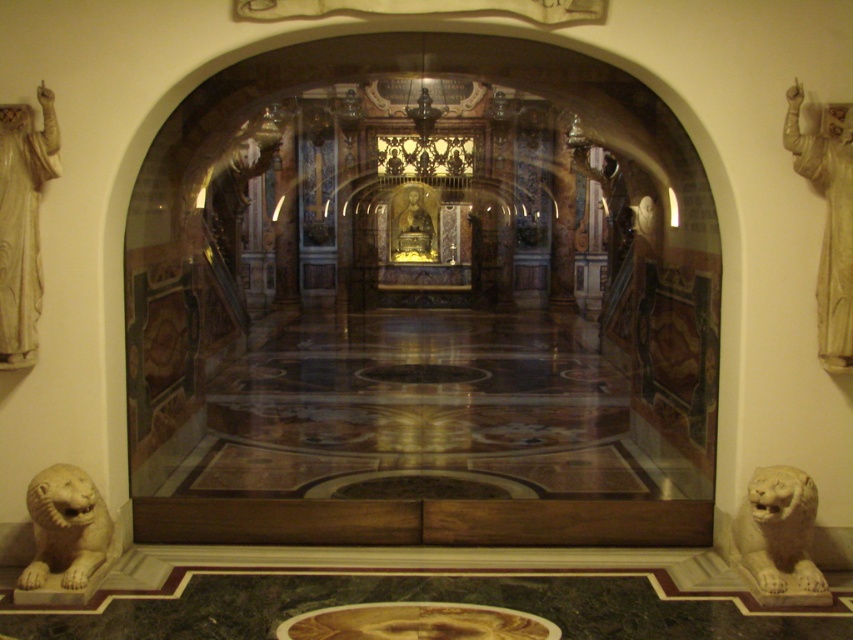
Question: Estimate the real-world distances between objects in this image. Which object is farther from the white marble lion at lower right?

Choices:
 (A) gold polished statue at center
 (B) white marble statue at left
 (C) white marble lion at lower left

Answer: (A)

Question: Is white marble statue at left wider than gold polished statue at center?

Choices:
 (A) yes
 (B) no

Answer: (B)

Question: Is white marble statue at upper right thinner than gold polished statue at center?

Choices:
 (A) yes
 (B) no

Answer: (A)

Question: Which object is farther from the camera taking this photo?

Choices:
 (A) white marble statue at left
 (B) white marble lion at lower left

Answer: (A)

Question: Which point appears farthest from the camera in this image?

Choices:
 (A) (42, 168)
 (B) (730, 528)

Answer: (B)

Question: Is white marble statue at left positioned before white marble statue at upper right?

Choices:
 (A) no
 (B) yes

Answer: (B)